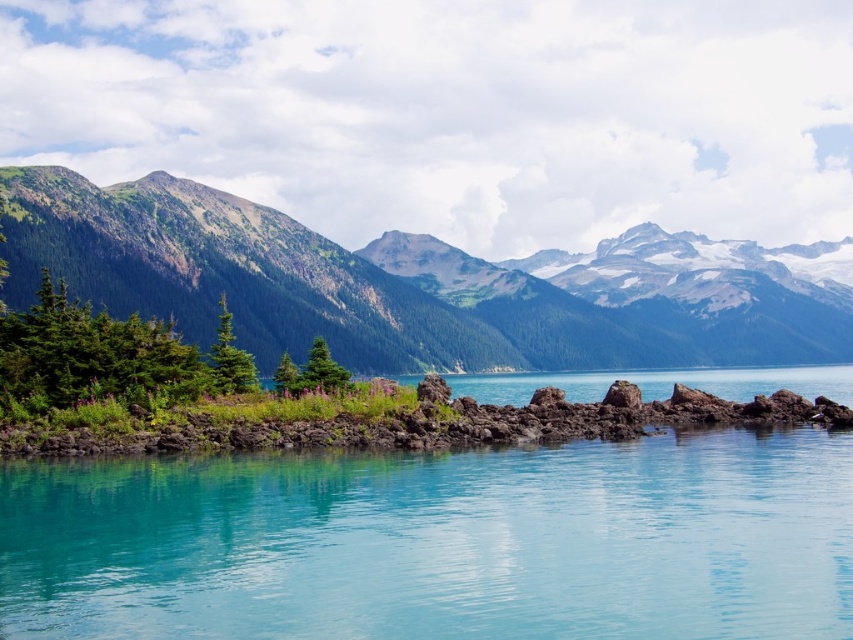
Which is behind, point (643, 454) or point (636, 324)?

The point (636, 324) is behind.

Is turquoise glossy water at center to the left of green rocky mountain at left from the viewer's perspective?

Indeed, turquoise glossy water at center is positioned on the left side of green rocky mountain at left.

Is point (508, 484) behind point (541, 368)?

No, it is not.

Identify the location of turquoise glossy water at center. (438, 541).